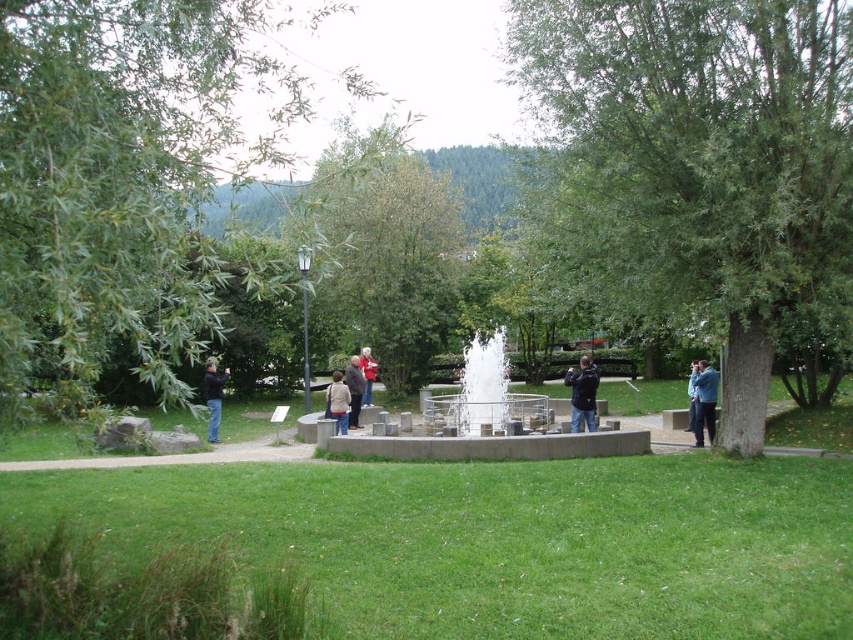
Question: Is green leafy tree at left to the right of matte black jacket at center from the viewer's perspective?

Choices:
 (A) no
 (B) yes

Answer: (A)

Question: Which object is closer to the camera taking this photo?

Choices:
 (A) green leafy tree at center
 (B) red fabric jacket at center
 (C) dark blue jeans at left

Answer: (A)

Question: Which of these objects is positioned closest to the matte black jacket at center?

Choices:
 (A) white concrete fountain at center
 (B) brown leather jacket at center
 (C) green leafy tree at left

Answer: (B)

Question: Is brown leather jacket at center to the left of blue denim jacket at lower right from the viewer's perspective?

Choices:
 (A) no
 (B) yes

Answer: (B)

Question: Is dark blue jeans at left smaller than red fabric jacket at center?

Choices:
 (A) no
 (B) yes

Answer: (B)

Question: Among these objects, which one is farthest from the camera?

Choices:
 (A) green leafy tree at center
 (B) dark blue jacket at center
 (C) white concrete fountain at center
 (D) brown leather jacket at center

Answer: (D)